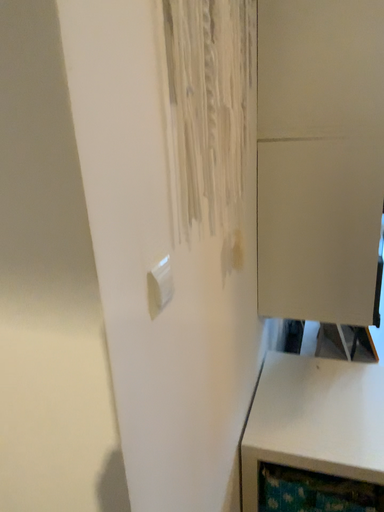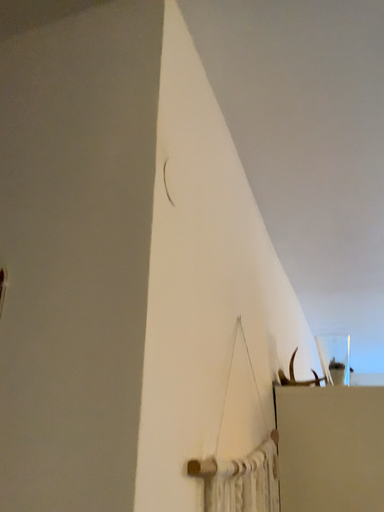
Question: How did the camera likely rotate when shooting the video?

Choices:
 (A) rotated downward
 (B) rotated upward

Answer: (B)